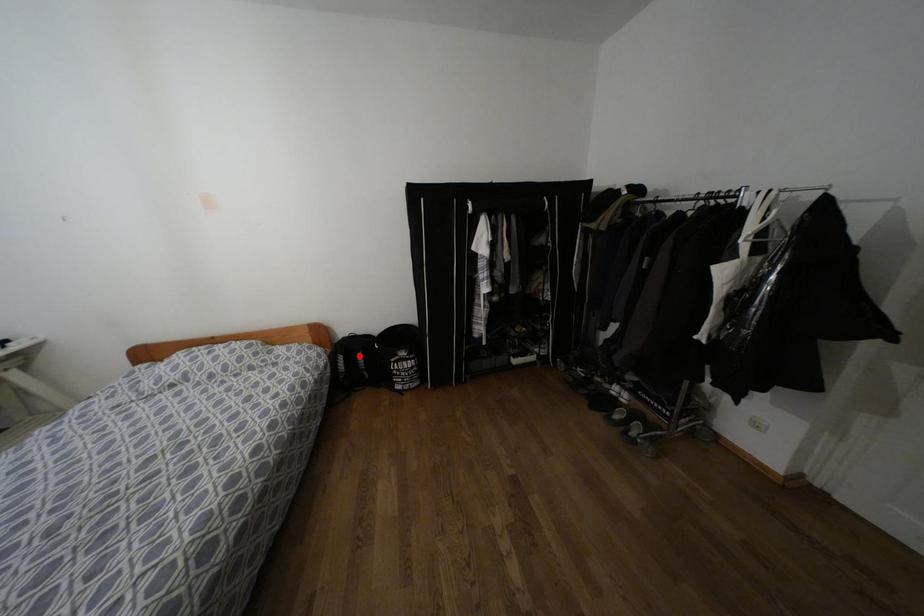
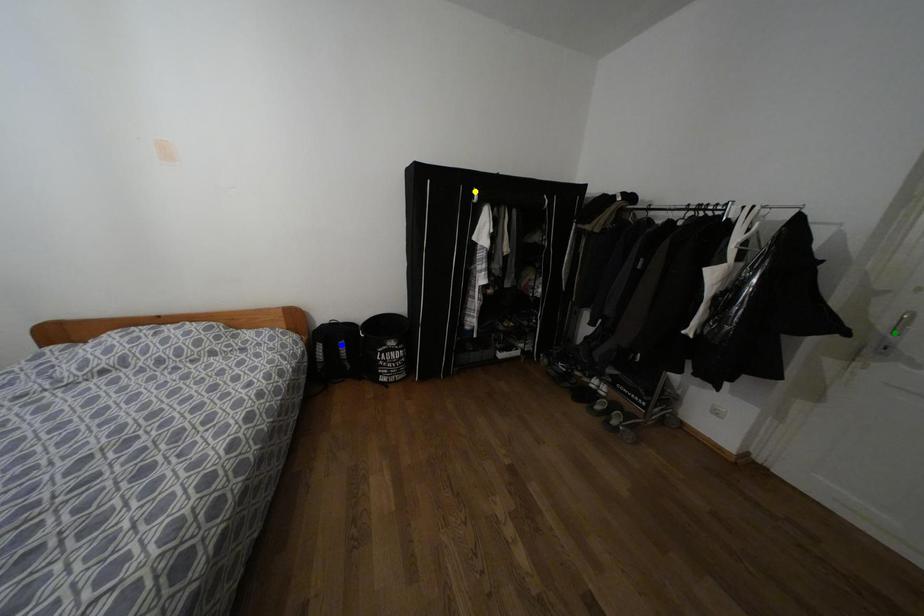
Question: I am providing you with two images of the same scene from different viewpoints. A red point is marked on the first image. You are given multiple points on the second image. In image 2, which mark is for the same physical point as the one in image 1?

Choices:
 (A) yellow point
 (B) blue point
 (C) green point

Answer: (B)